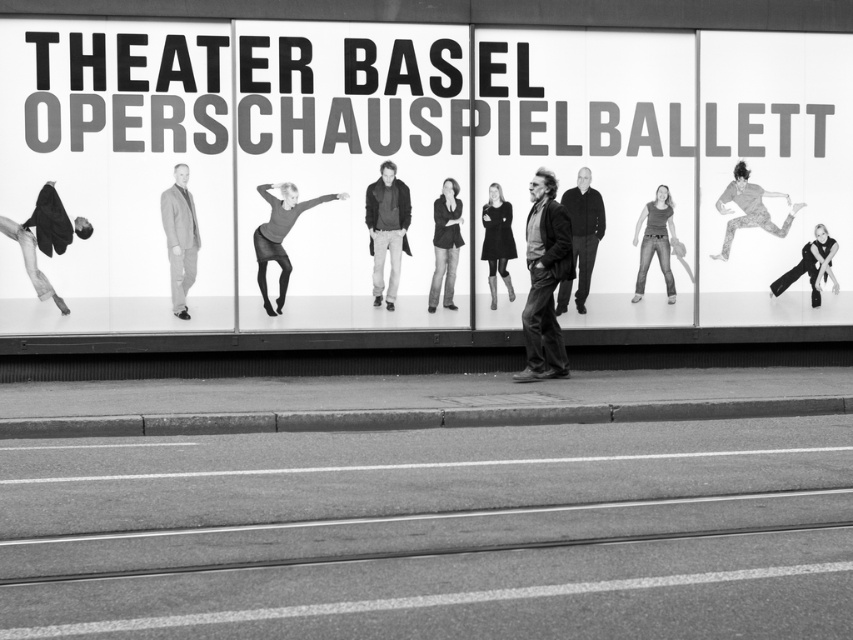
In the scene shown: You are standing in front of the Theater Basel Opernschauspielballett billboard and notice a point marked at coordinates (387, 228). According to the scene description, where exactly is this point located?

The point at (387, 228) is on the dark gray textured coat at center.

You are a photographer trying to capture the billboard advertisement while avoiding the man and his belongings in the foreground. Since the dark gray textured coat at center and the black matte skateboard at left are blocking your view, which object should you move to your left to get a clearer shot of the billboard?

The dark gray textured coat at center is to the right of the black matte skateboard at left. To get a clearer shot of the billboard, you should move to the left of the black matte skateboard at left, as it is positioned to the farthest left and moving past it would allow you to see around both objects.